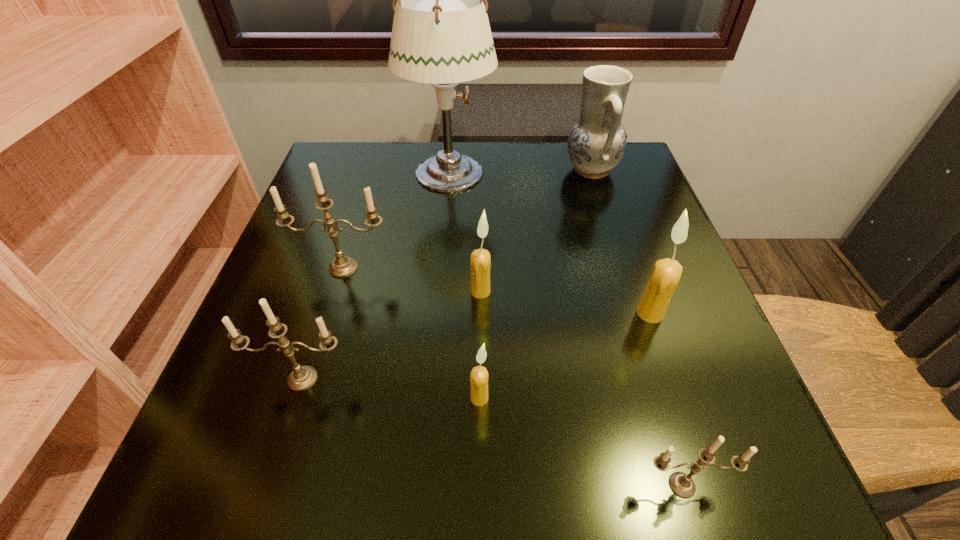
Locate an element on the screen. This screenshot has height=540, width=960. vacant area that lies between the nearest object and the second biggest metallic candle is located at coordinates (492, 432).

Locate an element on the screen. The image size is (960, 540). vacant area that lies between the lampshade and the farthest cream candle is located at coordinates (465, 233).

Identify the location of the closest object to the third farthest candle. This screenshot has height=540, width=960. (681, 484).

Identify the location of object that is the seventh closest to the second smallest cream candle. (681, 484).

Where is `candle identified as the fourth closest to the biggest cream candle`? The width and height of the screenshot is (960, 540). candle identified as the fourth closest to the biggest cream candle is located at coordinates (343, 266).

This screenshot has height=540, width=960. Identify the location of candle that is the fourth nearest to the second biggest cream candle. (x=666, y=273).

Where is `cream candle object that ranks as the second closest to the lampshade`? The image size is (960, 540). cream candle object that ranks as the second closest to the lampshade is located at coordinates (666, 273).

Identify which cream candle is the third closest to the nearest candle. Please provide its 2D coordinates. Your answer should be formatted as a tuple, i.e. [(x, y)], where the tuple contains the x and y coordinates of a point satisfying the conditions above.

[(480, 263)]

The height and width of the screenshot is (540, 960). I want to click on metallic candle object that ranks as the closest to the second nearest metallic candle, so click(343, 266).

You are a GUI agent. You are given a task and a screenshot of the screen. Output one action in this format:
    pyautogui.click(x=<x>, y=<y>)
    Task: Click on the metallic candle that is the closest to the sixth nearest object
    This screenshot has height=540, width=960.
    Given the screenshot: What is the action you would take?
    pyautogui.click(x=301, y=378)